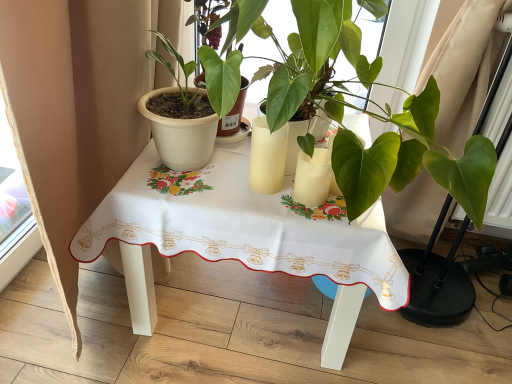
At what (x,y) coordinates should I click in order to perform the action: click on vacant space underneath white fabric table at center (from a real-world perspective). Please return your answer as a coordinate pair (x, y). This screenshot has height=384, width=512. Looking at the image, I should click on (239, 308).